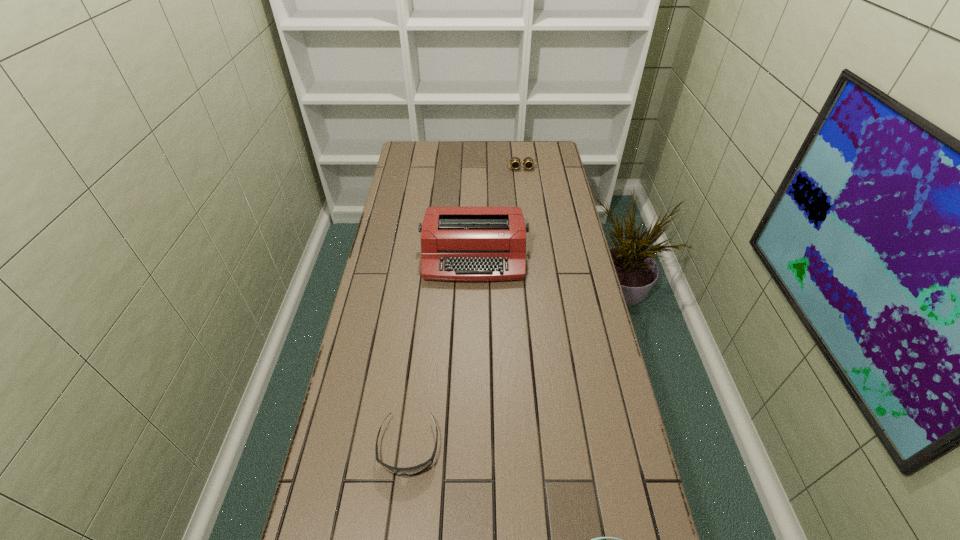
Where is `the third nearest object`? Image resolution: width=960 pixels, height=540 pixels. the third nearest object is located at coordinates (457, 243).

Locate an element on the screen. typewriter is located at coordinates (457, 243).

Find the location of a particular element. The image size is (960, 540). the farthest goggles is located at coordinates (515, 162).

In order to click on the second farthest goggles in this screenshot , I will do `click(408, 471)`.

Locate an element on the screen. The height and width of the screenshot is (540, 960). the leftmost goggles is located at coordinates (408, 471).

The width and height of the screenshot is (960, 540). Find the location of `vacant space positioned 0.300m on the typing side of the tallest object`. vacant space positioned 0.300m on the typing side of the tallest object is located at coordinates (472, 359).

The height and width of the screenshot is (540, 960). What are the coordinates of `vacant area located through the lenses of the farthest object` in the screenshot? It's located at (528, 222).

I want to click on free space located 0.090m on the lenses of the leftmost goggles, so click(400, 521).

You are a GUI agent. You are given a task and a screenshot of the screen. Output one action in this format:
    pyautogui.click(x=<x>, y=<y>)
    Task: Click on the object situated at the far edge
    This screenshot has width=960, height=540.
    Given the screenshot: What is the action you would take?
    pyautogui.click(x=515, y=162)

Locate an element on the screen. typewriter situated at the left edge is located at coordinates (457, 243).